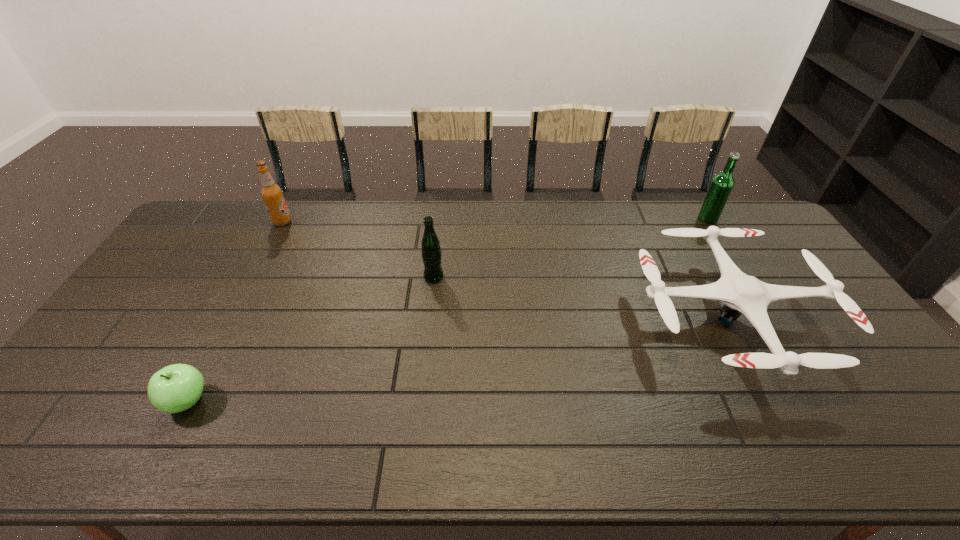
You are a GUI agent. You are given a task and a screenshot of the screen. Output one action in this format:
    pyautogui.click(x=<x>, y=<y>)
    Task: Click on the vacant space located 0.050m on the right of the shortest object
    The height and width of the screenshot is (540, 960).
    Given the screenshot: What is the action you would take?
    pyautogui.click(x=230, y=401)

Locate an element on the screen. The image size is (960, 540). object that is at the right edge is located at coordinates (741, 293).

Image resolution: width=960 pixels, height=540 pixels. Find the location of `vacant region at the far edge of the desktop`. vacant region at the far edge of the desktop is located at coordinates (324, 223).

Where is `vacant space at the near edge of the desktop`? This screenshot has height=540, width=960. vacant space at the near edge of the desktop is located at coordinates (130, 462).

You are a GUI agent. You are given a task and a screenshot of the screen. Output one action in this format:
    pyautogui.click(x=<x>, y=<y>)
    Task: Click on the vacant space at the left edge
    
    Given the screenshot: What is the action you would take?
    pyautogui.click(x=134, y=325)

Locate an element on the screen. The width and height of the screenshot is (960, 540). vacant space at the right edge is located at coordinates (822, 309).

You are a GUI agent. You are given a task and a screenshot of the screen. Output one action in this format:
    pyautogui.click(x=<x>, y=<y>)
    Task: Click on the vacant area at the far left corner of the desktop
    
    Given the screenshot: What is the action you would take?
    pyautogui.click(x=231, y=231)

I want to click on vacant area that lies between the nearest beer bottle and the fourth tallest object, so click(x=582, y=296).

This screenshot has height=540, width=960. I want to click on blank region between the nearest beer bottle and the shortest object, so click(311, 339).

This screenshot has height=540, width=960. What are the coordinates of `free spot between the second beer bottle from right to left and the apple` in the screenshot? It's located at (311, 339).